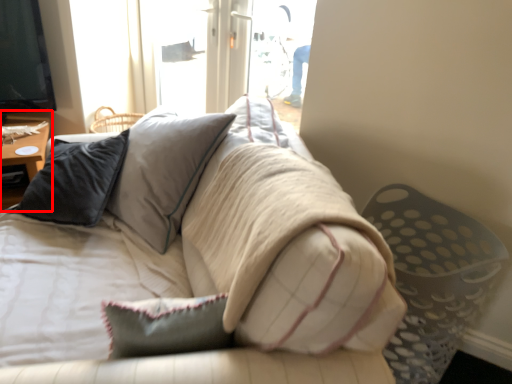
Question: Where is table (annotated by the red box) located in relation to studio couch in the image?

Choices:
 (A) right
 (B) left

Answer: (B)